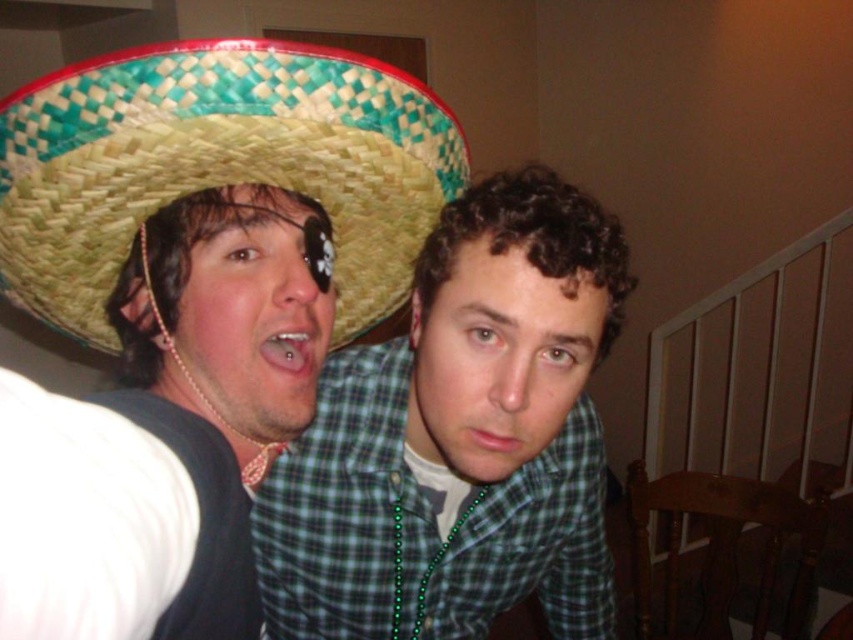
Is green plaid shirt at center above woven straw sombrero at upper left?

No, green plaid shirt at center is not above woven straw sombrero at upper left.

Which is behind, point (520, 333) or point (0, 136)?

The point (520, 333) is more distant.

Is point (428, 580) farther from viewer compared to point (409, 92)?

Yes, it is.

Where is `green plaid shirt at center`? This screenshot has width=853, height=640. green plaid shirt at center is located at coordinates (460, 436).